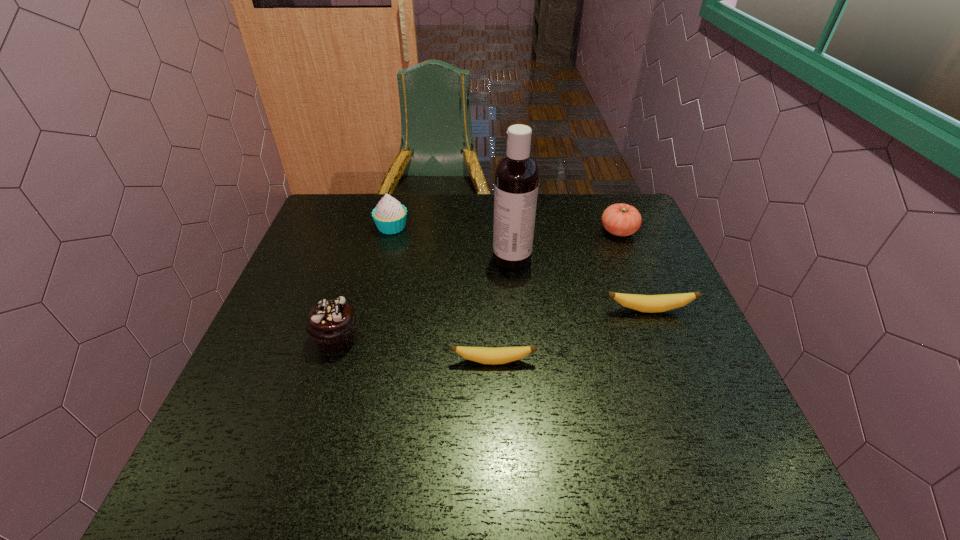
Locate an element on the screen. This screenshot has height=540, width=960. free location that satisfies the following two spatial constraints: 1. on the front side of the third nearest object; 2. on the left side of the farther cupcake is located at coordinates (371, 310).

Find the location of `free location that satisfies the following two spatial constraints: 1. on the back side of the nearer cupcake; 2. on the right side of the tomato`. free location that satisfies the following two spatial constraints: 1. on the back side of the nearer cupcake; 2. on the right side of the tomato is located at coordinates click(370, 231).

Identify the location of vacant space that satisfies the following two spatial constraints: 1. on the back side of the shortest object; 2. on the left side of the right banana. (492, 310).

I want to click on vacant area in the image that satisfies the following two spatial constraints: 1. on the front side of the shorter banana; 2. on the right side of the nearer cupcake, so click(x=329, y=361).